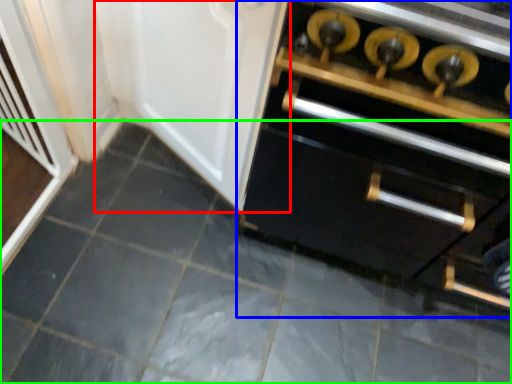
Question: Which object is the closest to the door (highlighted by a red box)? Choose among these: cabinetry (highlighted by a blue box) or ceramic tile (highlighted by a green box).

Choices:
 (A) cabinetry
 (B) ceramic tile

Answer: (A)